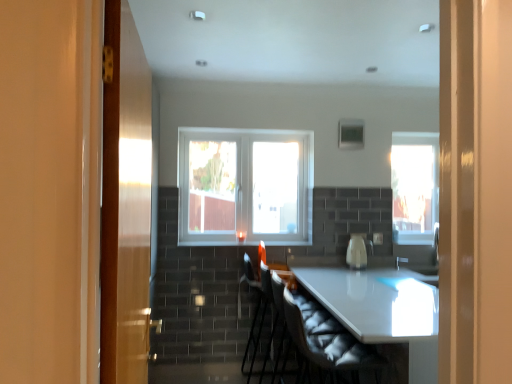
Question: From a real-world perspective, is transparent glass window at right, which is the 2th window from front to back, located higher than velvet black armchair at center, marked as the 2th armchair in a back-to-front arrangement?

Choices:
 (A) yes
 (B) no

Answer: (A)

Question: Does transparent glass window at right, the 1th window from the right, appear on the left side of velvet black armchair at center, the first armchair in the front-to-back sequence?

Choices:
 (A) yes
 (B) no

Answer: (B)

Question: Is transparent glass window at right, which is the 2th window from front to back, far from velvet black armchair at center, the first armchair in the front-to-back sequence?

Choices:
 (A) no
 (B) yes

Answer: (B)

Question: Is transparent glass window at right, which is the 2th window from front to back, turned away from velvet black armchair at center, marked as the 2th armchair in a back-to-front arrangement?

Choices:
 (A) no
 (B) yes

Answer: (A)

Question: Is the position of transparent glass window at right, the 1th window from the right, less distant than that of velvet black armchair at center, the first armchair in the front-to-back sequence?

Choices:
 (A) yes
 (B) no

Answer: (B)

Question: Considering the positions of white fabric swivel chair at center and clear glass window at center, which is the 2th window in back-to-front order, in the image, is white fabric swivel chair at center taller or shorter than clear glass window at center, which is the 2th window in back-to-front order,?

Choices:
 (A) short
 (B) tall

Answer: (A)

Question: Does point (327, 331) appear closer or farther from the camera than point (215, 167)?

Choices:
 (A) closer
 (B) farther

Answer: (A)

Question: In the image, is white fabric swivel chair at center positioned in front of or behind clear glass window at center, positioned as the 1th window in left-to-right order?

Choices:
 (A) behind
 (B) front

Answer: (B)

Question: Would you say white fabric swivel chair at center is to the left or to the right of clear glass window at center, which is the 2th window in back-to-front order, in the picture?

Choices:
 (A) left
 (B) right

Answer: (B)

Question: From the image's perspective, relative to white glossy kettle at center, is transparent glass window at right, the 1th window from the right, above or below?

Choices:
 (A) above
 (B) below

Answer: (A)

Question: Is transparent glass window at right, which is counted as the 2th window, starting from the left, to the left or to the right of white glossy kettle at center in the image?

Choices:
 (A) left
 (B) right

Answer: (B)

Question: Is transparent glass window at right, acting as the 1th window starting from the back, inside or outside of white glossy kettle at center?

Choices:
 (A) inside
 (B) outside

Answer: (B)

Question: Looking at their shapes, would you say transparent glass window at right, which is the 2th window from front to back, is wider or thinner than white glossy kettle at center?

Choices:
 (A) thin
 (B) wide

Answer: (A)

Question: Considering their positions, is velvet black armchair at center, marked as the 2th armchair in a back-to-front arrangement, located in front of or behind white fabric swivel chair at center?

Choices:
 (A) front
 (B) behind

Answer: (B)

Question: Which is correct: velvet black armchair at center, the first armchair in the front-to-back sequence, is inside white fabric swivel chair at center, or outside of it?

Choices:
 (A) outside
 (B) inside

Answer: (A)